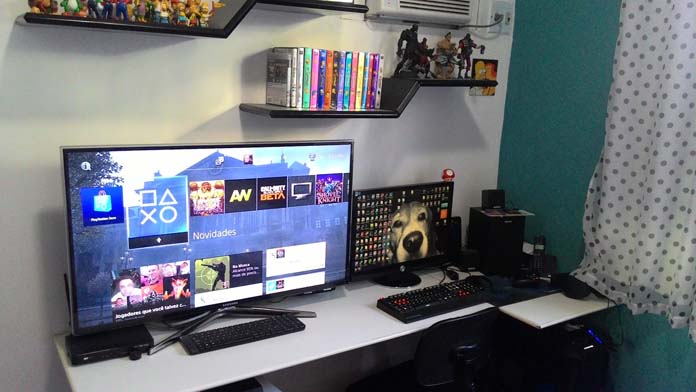
The height and width of the screenshot is (392, 696). I want to click on monitor, so click(x=403, y=232).